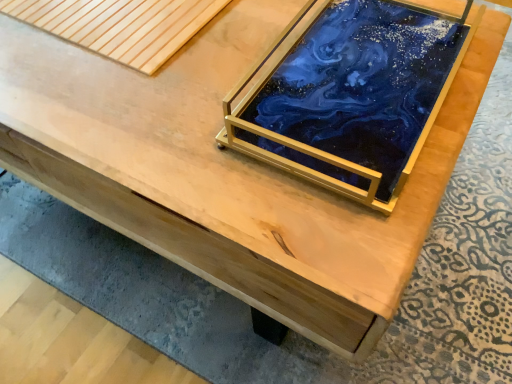
Question: Could natural wood plank at upper left be considered to be inside blue resin tray at center?

Choices:
 (A) yes
 (B) no

Answer: (B)

Question: Is blue resin tray at center facing towards natural wood plank at upper left?

Choices:
 (A) yes
 (B) no

Answer: (B)

Question: Is blue resin tray at center next to natural wood plank at upper left?

Choices:
 (A) yes
 (B) no

Answer: (B)

Question: From the image's perspective, would you say blue resin tray at center is positioned over natural wood plank at upper left?

Choices:
 (A) no
 (B) yes

Answer: (A)

Question: From a real-world perspective, does blue resin tray at center stand above natural wood plank at upper left?

Choices:
 (A) no
 (B) yes

Answer: (B)

Question: Considering the relative sizes of blue resin tray at center and natural wood plank at upper left in the image provided, is blue resin tray at center wider than natural wood plank at upper left?

Choices:
 (A) no
 (B) yes

Answer: (B)

Question: Can you confirm if natural wood plank at upper left is thinner than blue resin tray at center?

Choices:
 (A) no
 (B) yes

Answer: (B)

Question: Is natural wood plank at upper left facing away from blue resin tray at center?

Choices:
 (A) no
 (B) yes

Answer: (A)

Question: Is natural wood plank at upper left shorter than blue resin tray at center?

Choices:
 (A) no
 (B) yes

Answer: (B)

Question: From the image's perspective, is natural wood plank at upper left located beneath blue resin tray at center?

Choices:
 (A) no
 (B) yes

Answer: (A)

Question: Is natural wood plank at upper left to the right of blue resin tray at center from the viewer's perspective?

Choices:
 (A) no
 (B) yes

Answer: (A)

Question: Does natural wood plank at upper left have a larger size compared to blue resin tray at center?

Choices:
 (A) yes
 (B) no

Answer: (B)

Question: In the image, is blue resin tray at center positioned in front of or behind natural wood plank at upper left?

Choices:
 (A) front
 (B) behind

Answer: (A)